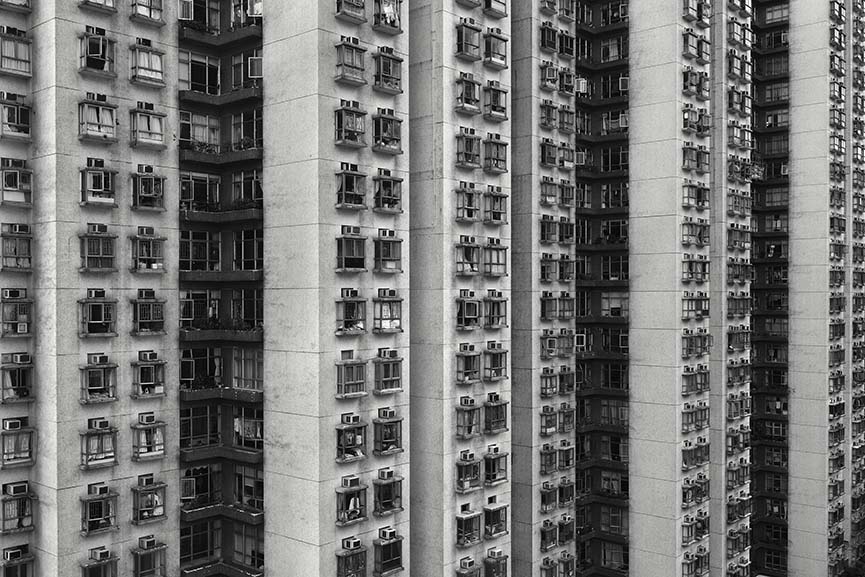
Locate an element on the screen. The image size is (865, 577). window unit farthest top left in image is located at coordinates (22, 3).